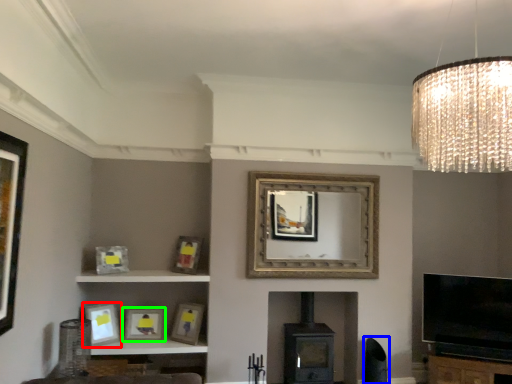
Question: Which is nearer to the picture frame (highlighted by a red box)? swivel chair (highlighted by a blue box) or picture frame (highlighted by a green box).

Choices:
 (A) swivel chair
 (B) picture frame

Answer: (B)